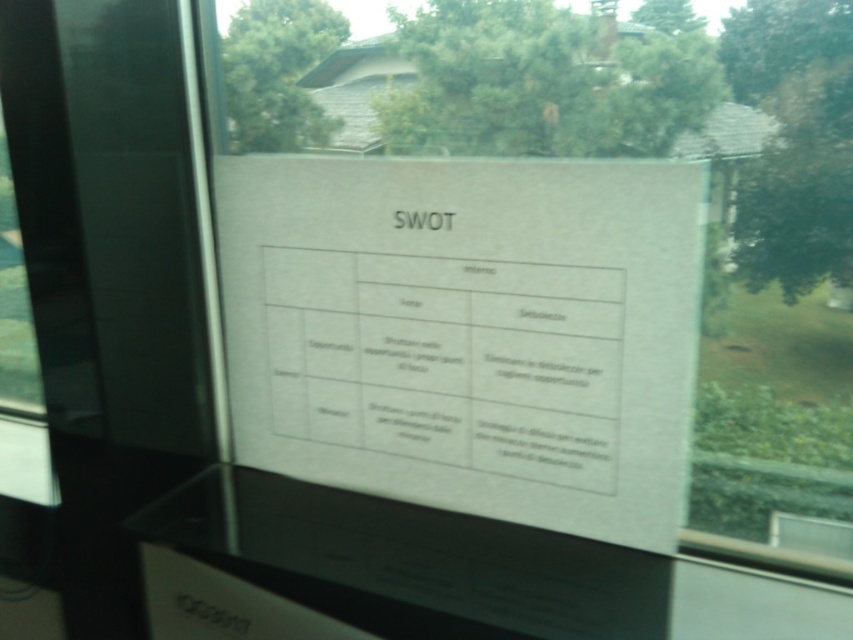
Question: Is transparent glass window at center above white paper at upper center?

Choices:
 (A) yes
 (B) no

Answer: (A)

Question: Among these objects, which one is farthest from the camera?

Choices:
 (A) white paper at upper center
 (B) transparent glass window at center

Answer: (B)

Question: Which point is closer to the camera taking this photo?

Choices:
 (A) pos(457,499)
 (B) pos(402,214)

Answer: (B)

Question: Is transparent glass window at center closer to the viewer compared to white paper at upper center?

Choices:
 (A) no
 (B) yes

Answer: (A)

Question: Can you confirm if transparent glass window at center is positioned to the left of white paper at upper center?

Choices:
 (A) yes
 (B) no

Answer: (B)